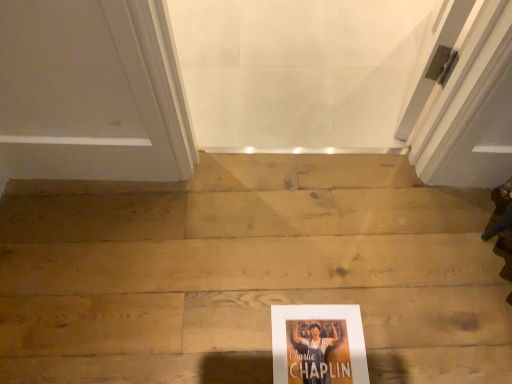
In order to face matte paper charlie chaplin poster at lower center, should I rotate leftwards or rightwards?

You should rotate right by 8.898 degrees.

What do you see at coordinates (318, 344) in the screenshot? The image size is (512, 384). I see `matte paper charlie chaplin poster at lower center` at bounding box center [318, 344].

I want to click on matte paper charlie chaplin poster at lower center, so click(318, 344).

The width and height of the screenshot is (512, 384). I want to click on matte paper charlie chaplin poster at lower center, so click(x=318, y=344).